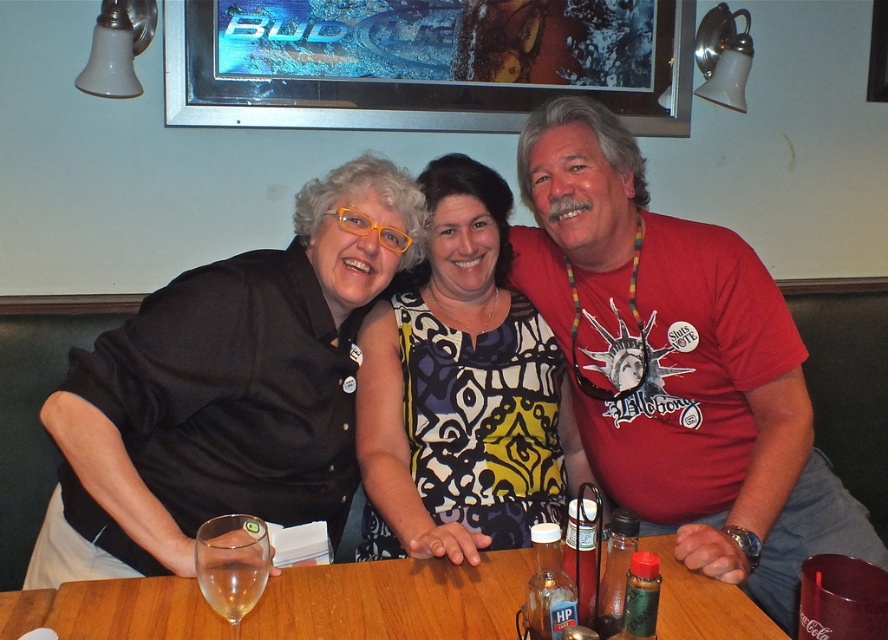
Question: Where is red matte shirt at center located in relation to clear glass wine glass at lower left in the image?

Choices:
 (A) above
 (B) below

Answer: (A)

Question: Can you confirm if wooden table at center is positioned to the right of clear glass wine glass at lower left?

Choices:
 (A) no
 (B) yes

Answer: (B)

Question: Which of the following is the farthest from the observer?

Choices:
 (A) (555, 352)
 (B) (379, 634)
 (C) (718, 269)
 (D) (215, 570)

Answer: (A)

Question: Among these points, which one is nearest to the camera?

Choices:
 (A) (205, 520)
 (B) (125, 593)
 (C) (680, 417)
 (D) (448, 278)

Answer: (B)

Question: Estimate the real-world distances between objects in this image. Which object is farther from the wooden table at center?

Choices:
 (A) printed fabric dress at center
 (B) clear glass wine glass at lower left
 (C) red matte shirt at center

Answer: (C)

Question: Is red matte shirt at center positioned in front of printed fabric dress at center?

Choices:
 (A) no
 (B) yes

Answer: (B)